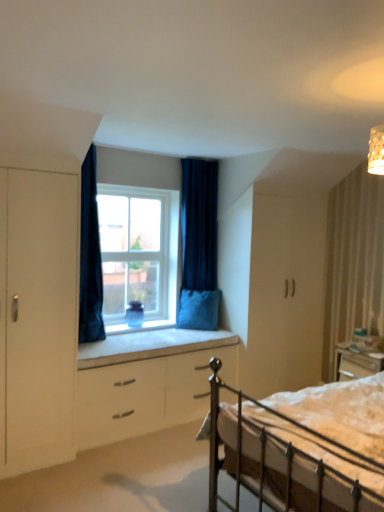
Locate an element on the screen. free space to the right of dark blue velvet curtain at upper center, positioned as the 2th curtain in right-to-left order is located at coordinates (130, 338).